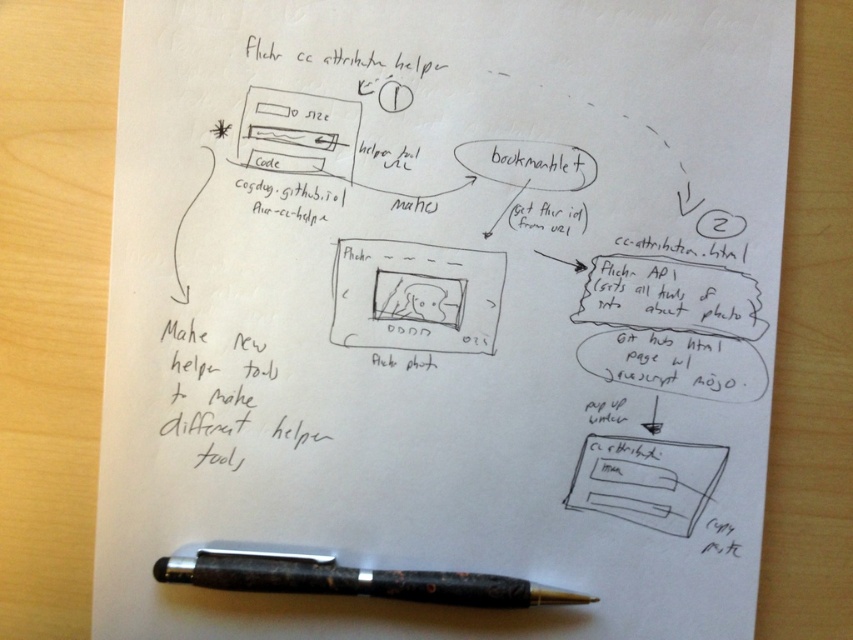
You are a student who needs to sign your name on the white paper at bottom right. You see the black textured pen at bottom. Is the pen within reach to sign the paper without moving your hand from its current position?

The black textured pen at bottom is below the white paper at bottom right, so it is positioned lower than the paper. If your hand is currently near the paper, you would need to move it downward to reach the pen. Therefore, the pen is not within immediate reach without adjusting your hand position.